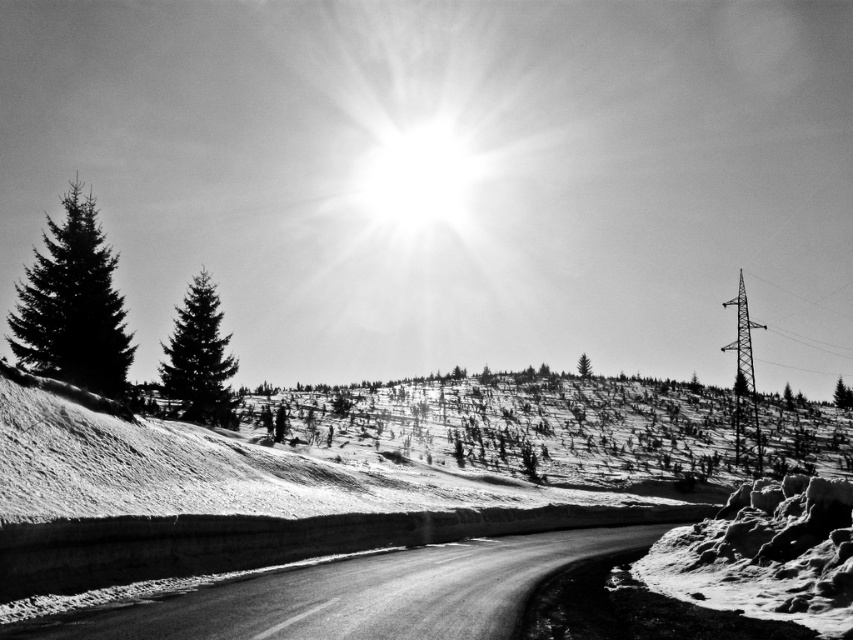
You are a photographer standing at the point marked as point (73, 305) in the image. You want to capture a photo of the dark green textured pine tree at left. Since you are at that point, will the pine tree be visible in your photo?

Yes, the point (73, 305) corresponds to the dark green textured pine tree at left, so you are standing right at the location of the pine tree. Therefore, the pine tree will be visible in your photo.

You are a photographer setting up a tripod to capture the winter landscape. You want to ensure that both the smooth asphalt road at center and the dark green textured tree at center are visible in your shot. Given their relative sizes in the image, which object will appear smaller in the final photograph?

The smooth asphalt road at center will appear smaller in the final photograph because it is shorter than the dark green textured tree at center according to the description.

You are a photographer standing on the snowy road and want to capture both the dark green textured pine tree at left and the dark green textured tree at center in a single photo. However, you notice that one of them is blocking the view of the other. Which tree is closer to you, making it appear in front?

The dark green textured pine tree at left is in front of the dark green textured tree at center, so it is closer to you and blocking the view of the other tree.